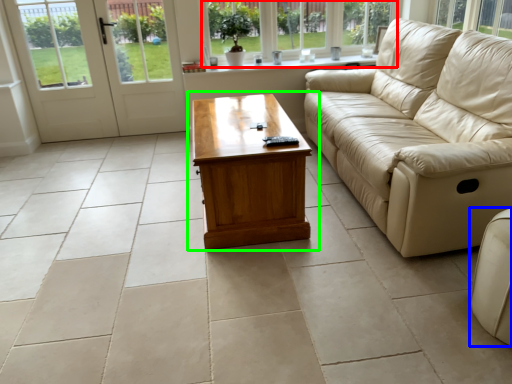
Question: Based on their relative distances, which object is nearer to window (highlighted by a red box)? Choose from studio couch (highlighted by a blue box) and coffee table (highlighted by a green box).

Choices:
 (A) studio couch
 (B) coffee table

Answer: (B)